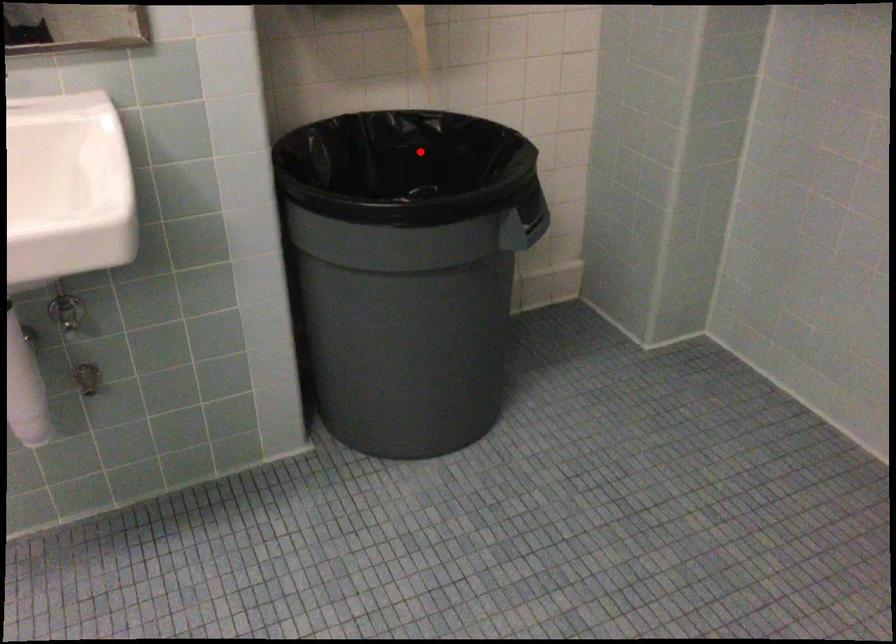
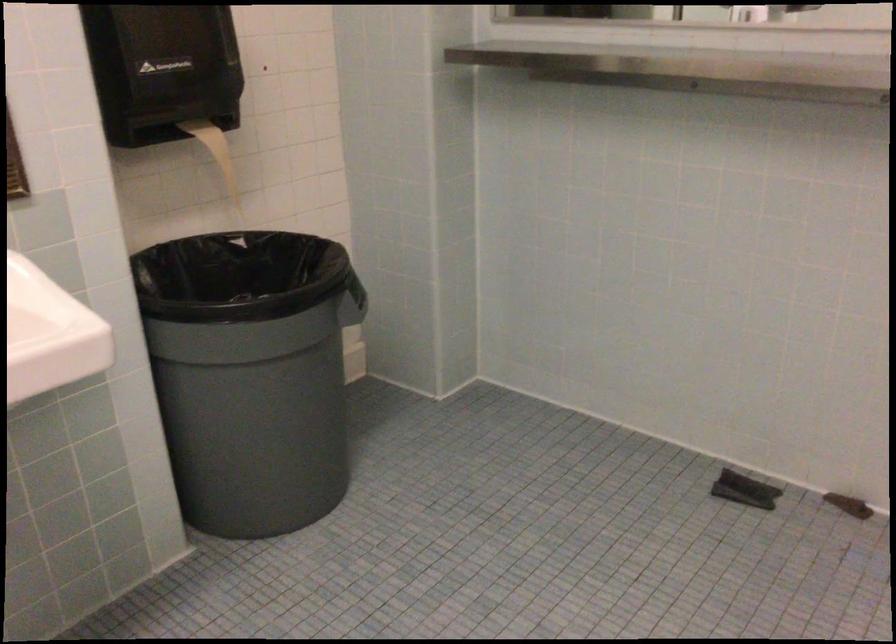
Question: I am providing you with two images of the same scene from different viewpoints. In image1, a red point is highlighted. Considering the same 3D point in image2, which of the following is correct?

Choices:
 (A) It is closer
 (B) It is farther

Answer: (B)